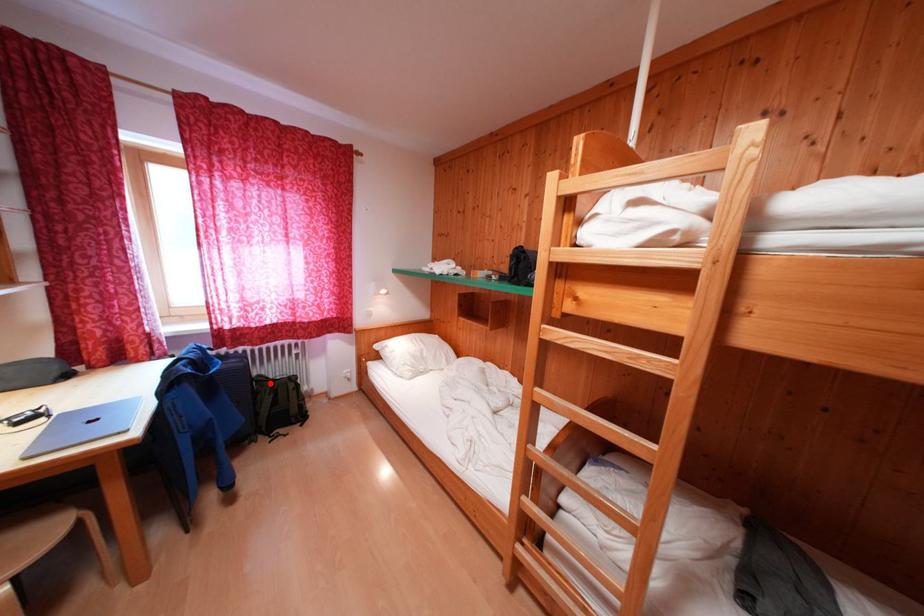
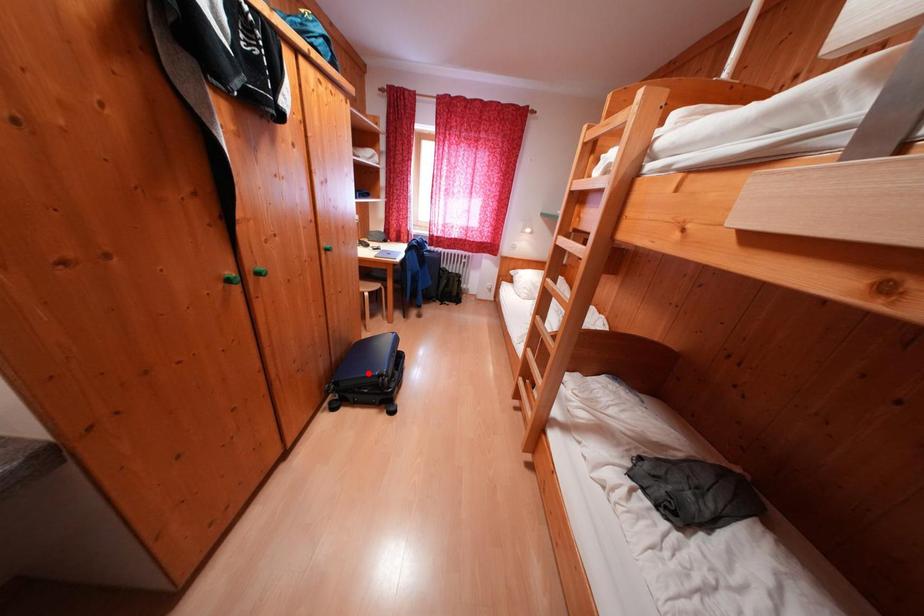
I am providing you with two images of the same scene from different viewpoints. A red point is marked on the first image and another point is marked on the second image. Do the highlighted points in image1 and image2 indicate the same real-world spot?

No